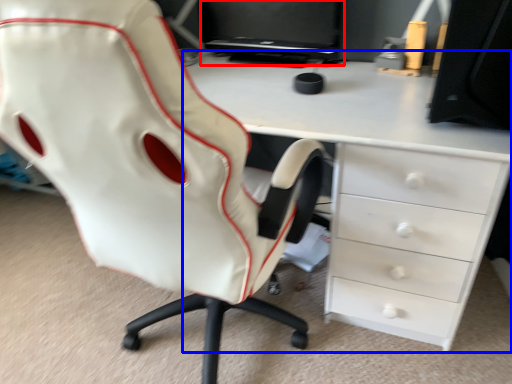
Question: Which point is further to the camera, computer monitor (highlighted by a red box) or desk (highlighted by a blue box)?

Choices:
 (A) computer monitor
 (B) desk

Answer: (A)